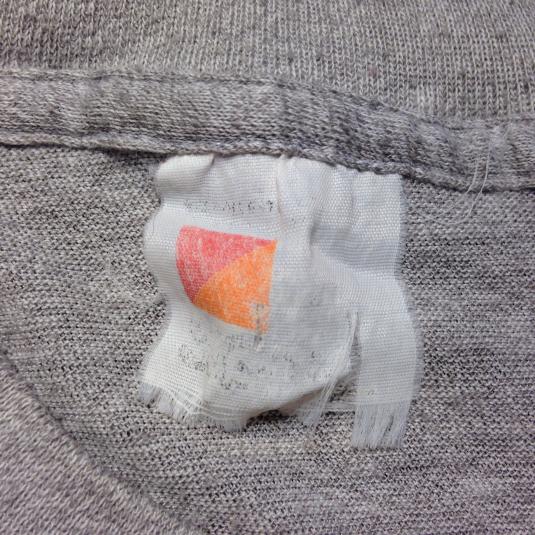
The image size is (535, 535). I want to click on damaged fabric, so click(170, 409), click(395, 418).